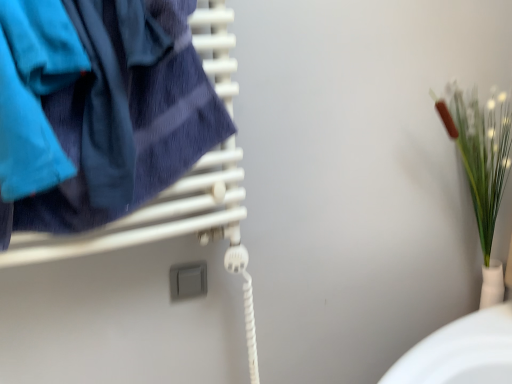
Locate an element on the screen. This screenshot has width=512, height=384. blue cotton towel at left is located at coordinates (133, 133).

This screenshot has height=384, width=512. Describe the element at coordinates (133, 133) in the screenshot. I see `blue cotton towel at left` at that location.

Locate an element on the screen. The image size is (512, 384). blue cotton towel at left is located at coordinates (133, 133).